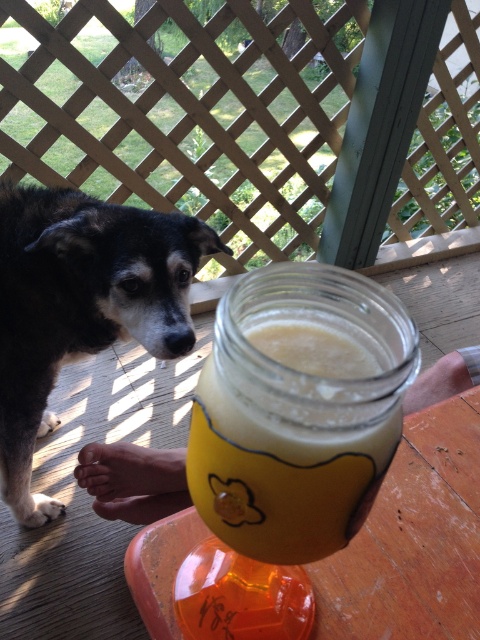
You are planning to place a new decorative item on the wooden deck where the black fur dog at left and the yellow matte jar at center are located. If you want to ensure the new item doesn not block the view of the jar, which object should you position closer to the edge of the deck?

You should position the black fur dog at left closer to the edge of the deck because it is wider than the yellow matte jar at center, so placing the wider object closer to the edge will keep the narrower jar more centrally visible.

In the scene shown: You are standing on the wooden deck and want to pick up the jar. Which point, point (x=72, y=244) or point (x=395, y=420), is closer to you?

Point (x=72, y=244) is closer to you because it is further to the camera than point (x=395, y=420).

You are a photographer standing on the wooden deck. You want to take a photo that includes both the black fur dog at left and the yellow matte jar at center. Considering their sizes, which object should you focus on first to ensure both are in frame?

The black fur dog at left is much taller than the yellow matte jar at center, so you should focus on the dog first to ensure the entire jar is captured in the frame.